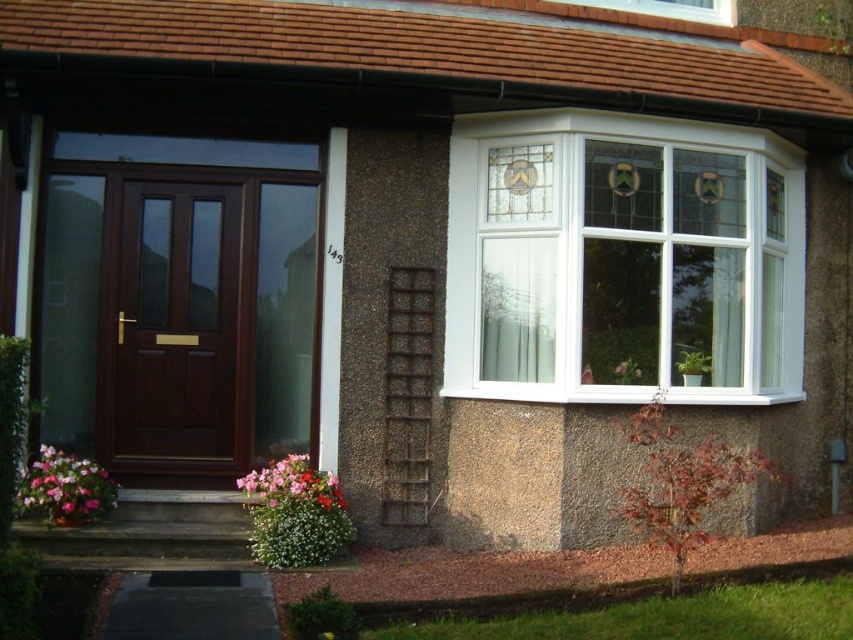
You are a delivery person approaching the house and need to place a package at the base of the multicolored fabric flower at lower center. However, there is a white plastic bay window at upper right nearby. Can you fit the package there without it touching the window?

The white plastic bay window at upper right is larger in size than the multicolored fabric flower at lower center. Since the bay window is bigger, there should be enough space to place the package at the base of the flower without it touching the window.

You are a delivery person holding a package that needs to be placed 3 meters away from the matte brown door at center. Can you place it near the white plastic bay window at upper right?

The distance between the white plastic bay window at upper right and the matte brown door at center is 2.66 meters, so placing the package near the white plastic bay window at upper right would be within the 3 meters requirement.